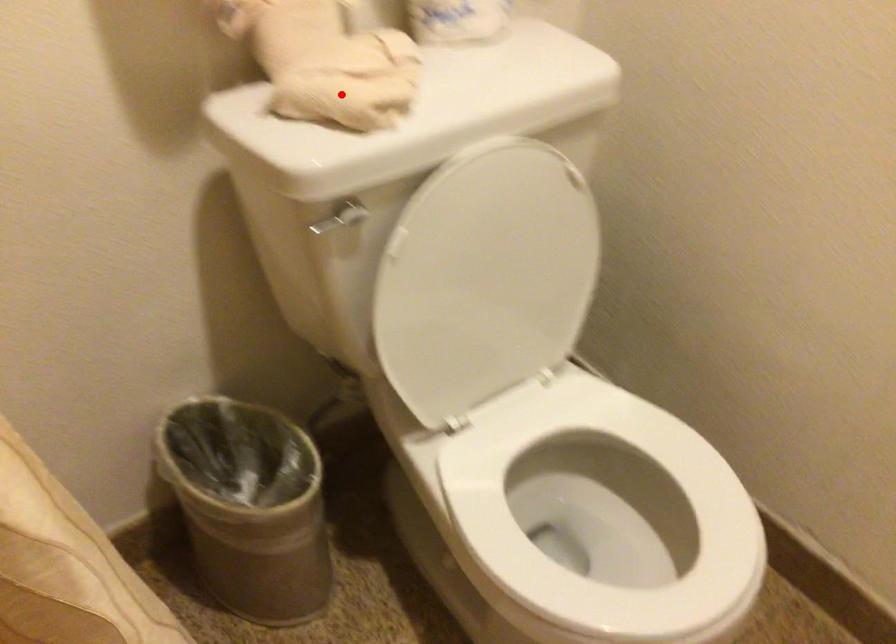
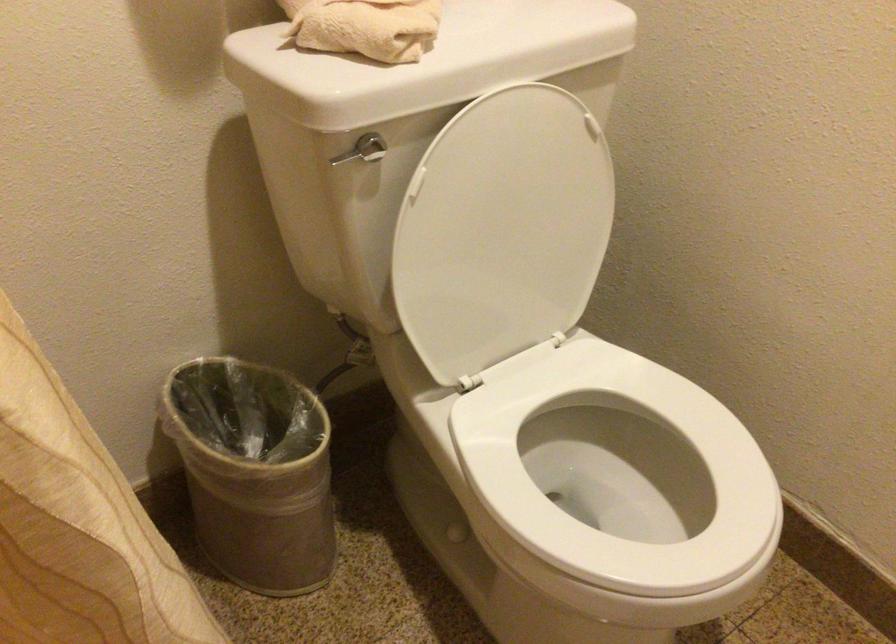
Find the pixel in the second image that matches the highlighted location in the first image.

(365, 26)